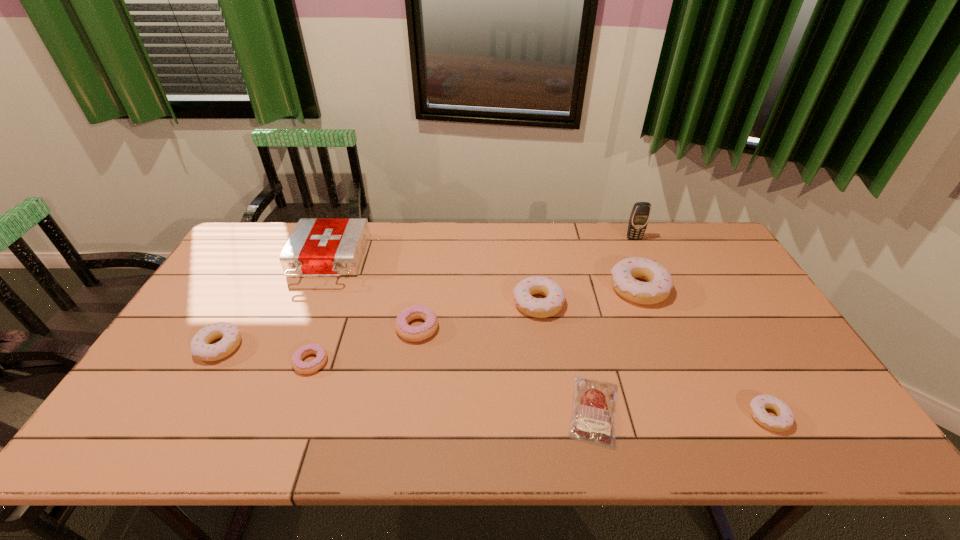
Identify the location of object located at the near right corner. This screenshot has width=960, height=540. pos(785,417).

In the image, there is a desktop. At what (x,y) coordinates should I click in order to perform the action: click on vacant space at the far edge. Please return your answer as a coordinate pair (x, y). Image resolution: width=960 pixels, height=540 pixels. Looking at the image, I should click on (551, 234).

You are a GUI agent. You are given a task and a screenshot of the screen. Output one action in this format:
    pyautogui.click(x=<x>, y=<y>)
    Task: Click on the free spot at the near edge of the desktop
    The height and width of the screenshot is (540, 960).
    Given the screenshot: What is the action you would take?
    pyautogui.click(x=212, y=426)

Locate an element on the screen. The image size is (960, 540). free location at the left edge of the desktop is located at coordinates (214, 295).

The width and height of the screenshot is (960, 540). In the image, there is a desktop. What are the coordinates of `vacant region at the right edge` in the screenshot? It's located at (756, 328).

You are a GUI agent. You are given a task and a screenshot of the screen. Output one action in this format:
    pyautogui.click(x=<x>, y=<y>)
    Task: Click on the free spot between the seventh shortest object and the first-aid kit
    
    Given the screenshot: What is the action you would take?
    pyautogui.click(x=484, y=274)

Where is `free space between the nearest doughnut and the left pink doughnut`? free space between the nearest doughnut and the left pink doughnut is located at coordinates (540, 389).

You are a GUI agent. You are given a task and a screenshot of the screen. Output one action in this format:
    pyautogui.click(x=<x>, y=<y>)
    Task: Click on the vacant region between the nearest doughnut and the second doughnut from right to left
    
    Given the screenshot: What is the action you would take?
    pyautogui.click(x=704, y=353)

Where is `vacant region between the second biggest white doughnut and the third white doughnut from left to right`? Image resolution: width=960 pixels, height=540 pixels. vacant region between the second biggest white doughnut and the third white doughnut from left to right is located at coordinates (588, 296).

Where is `vacant area that lies between the third doughnut from right to left and the cellular telephone`? This screenshot has height=540, width=960. vacant area that lies between the third doughnut from right to left and the cellular telephone is located at coordinates (586, 271).